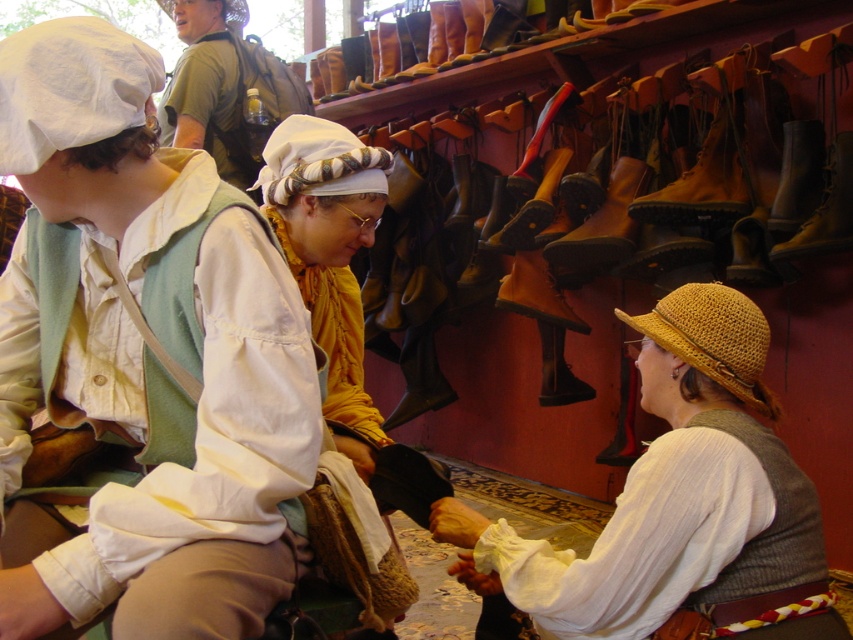
Question: Is white woven hat at center in front of leather boot at center?

Choices:
 (A) yes
 (B) no

Answer: (A)

Question: Which of the following is the closest to the observer?

Choices:
 (A) (786, 483)
 (B) (544, 317)

Answer: (A)

Question: Which of the following is the farthest from the observer?

Choices:
 (A) (228, 294)
 (B) (352, 140)

Answer: (B)

Question: Which point is closer to the camera?

Choices:
 (A) white woven straw hat at upper center
 (B) white woven hat at center
 (C) matte straw hat at upper right
 (D) leather boot at center

Answer: (C)

Question: Does matte straw hat at upper right have a greater width compared to golden straw hat at lower right?

Choices:
 (A) yes
 (B) no

Answer: (A)

Question: Can you confirm if straw hat at center is positioned to the right of leather boot at center?

Choices:
 (A) no
 (B) yes

Answer: (B)